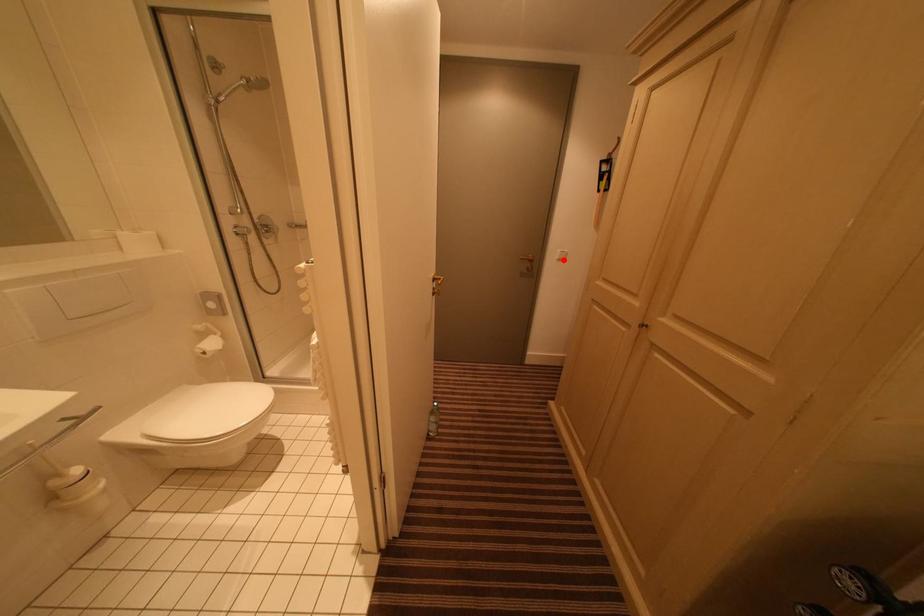
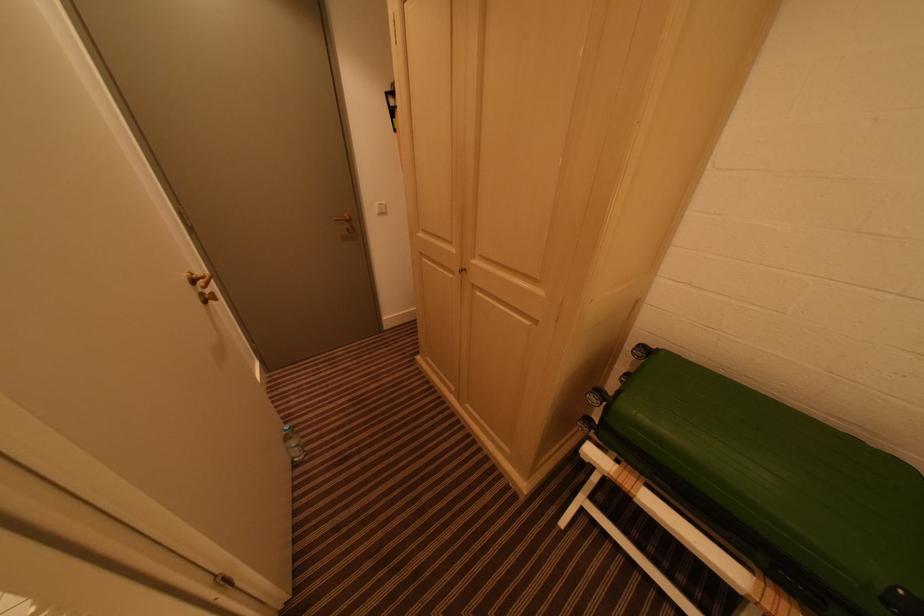
The point at the highlighted location is marked in the first image. Where is the corresponding point in the second image?

(383, 214)